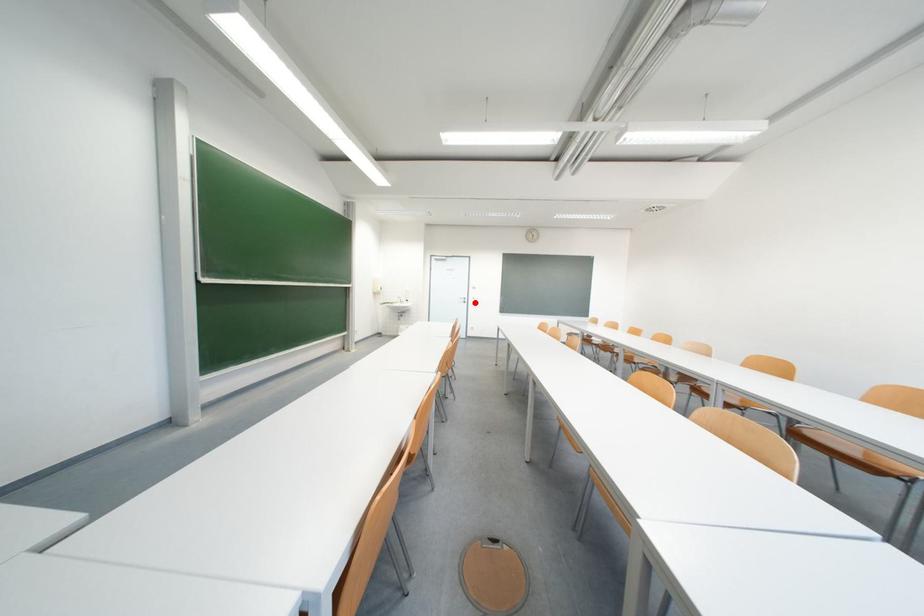
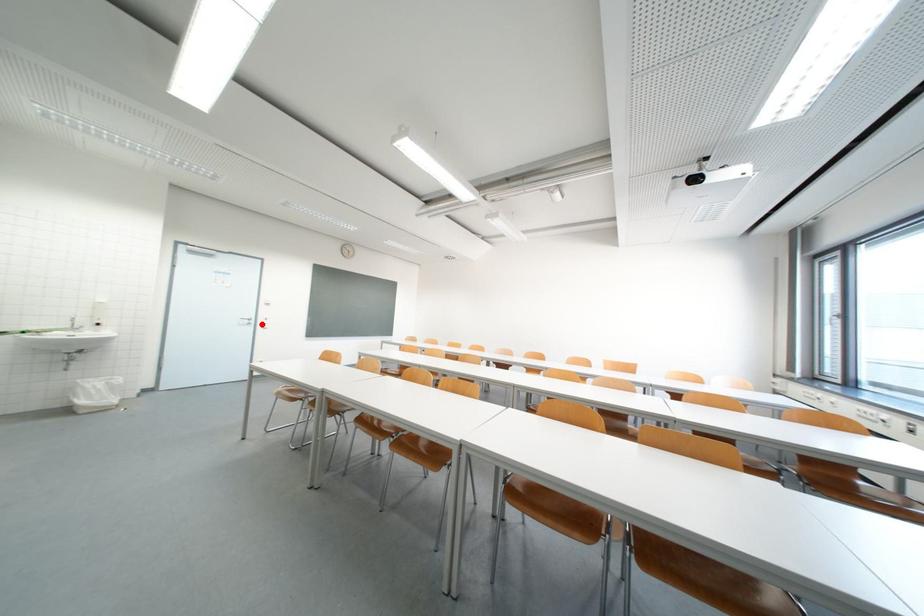
From the picture: I am providing you with two images of the same scene from different viewpoints. A red point is marked on the first image and another point is marked on the second image. Are the points marked in image1 and image2 representing the same 3D position?

Yes